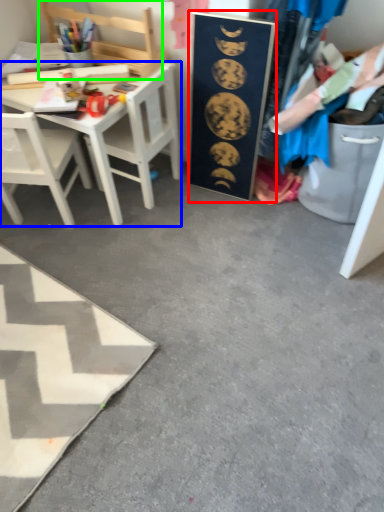
Question: Which object is positioned farthest from bulletin board (highlighted by a red box)? Select from desk (highlighted by a blue box) and chair (highlighted by a green box).

Choices:
 (A) desk
 (B) chair

Answer: (B)